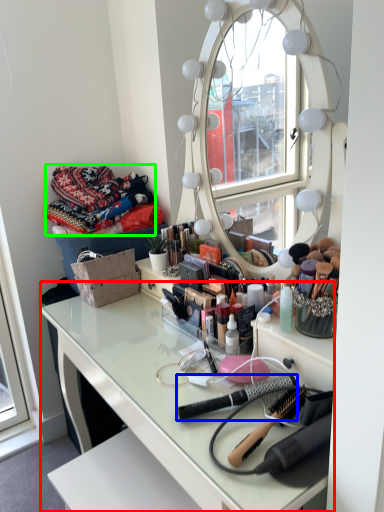
Question: Which object is the closest to the table (highlighted by a red box)? Choose among these: brush (highlighted by a blue box) or material (highlighted by a green box).

Choices:
 (A) brush
 (B) material

Answer: (A)